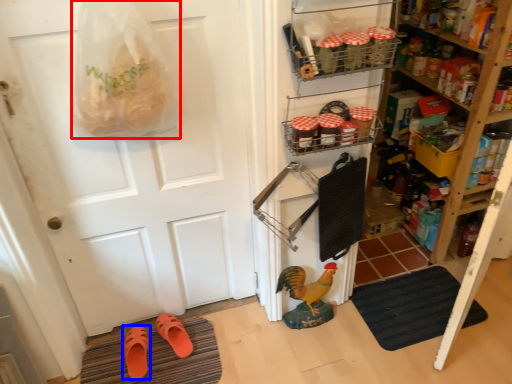
Question: Among these objects, which one is farthest to the camera, grocery bag (highlighted by a red box) or footwear (highlighted by a blue box)?

Choices:
 (A) grocery bag
 (B) footwear

Answer: (B)